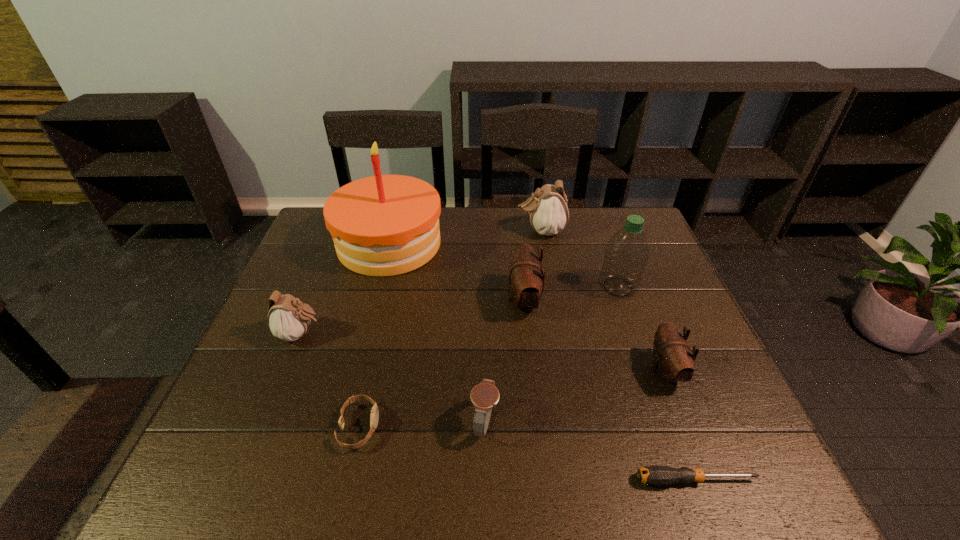
The image size is (960, 540). I want to click on the nearer brown pouch, so click(673, 361).

Where is `the rightmost pouch`? the rightmost pouch is located at coordinates (673, 361).

Where is `gray watch`? This screenshot has width=960, height=540. gray watch is located at coordinates (484, 396).

At what (x,y) coordinates should I click in order to perform the action: click on the taller watch. Please return your answer as a coordinate pair (x, y). Looking at the image, I should click on (484, 396).

You are a GUI agent. You are given a task and a screenshot of the screen. Output one action in this format:
    pyautogui.click(x=<x>, y=<y>)
    Task: Click on the second shortest object
    
    Given the screenshot: What is the action you would take?
    pyautogui.click(x=374, y=416)

The width and height of the screenshot is (960, 540). Find the location of `the left watch`. the left watch is located at coordinates (374, 416).

Identify the location of the nearest object. (651, 475).

Image resolution: width=960 pixels, height=540 pixels. I want to click on screwdriver, so click(x=651, y=475).

At what (x,y) coordinates should I click in order to perform the action: click on vacant position located on the right of the tallest object. Please return your answer as a coordinate pair (x, y). The image size is (960, 540). Looking at the image, I should click on (509, 244).

Identify the location of free region located 0.350m on the front of the second tallest object. (661, 414).